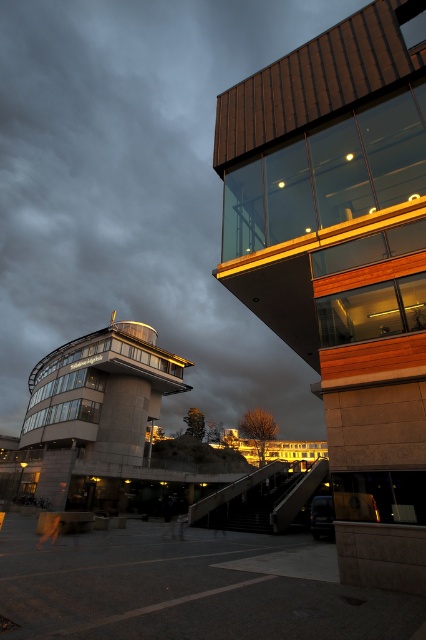
Question: Which of the following is the farthest from the observer?

Choices:
 (A) (80, 352)
 (B) (325, 72)

Answer: (A)

Question: Which point appears farthest from the camera in this image?

Choices:
 (A) (138, 349)
 (B) (350, 104)

Answer: (A)

Question: Is dark brown wooden tower at upper right below matte glass control tower at center-left?

Choices:
 (A) yes
 (B) no

Answer: (B)

Question: Is dark brown wooden tower at upper right positioned at the back of matte glass control tower at center-left?

Choices:
 (A) yes
 (B) no

Answer: (B)

Question: Is dark brown wooden tower at upper right positioned behind matte glass control tower at center-left?

Choices:
 (A) no
 (B) yes

Answer: (A)